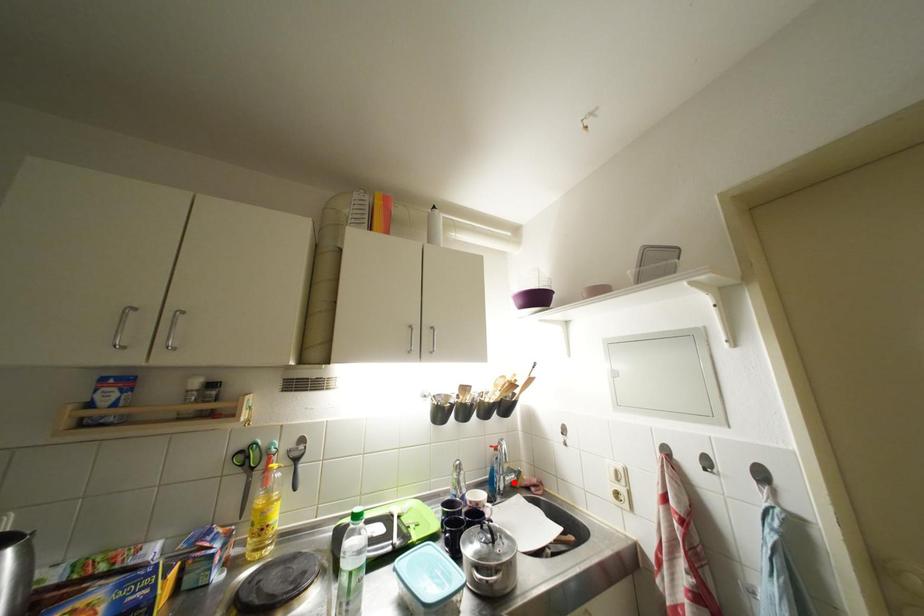
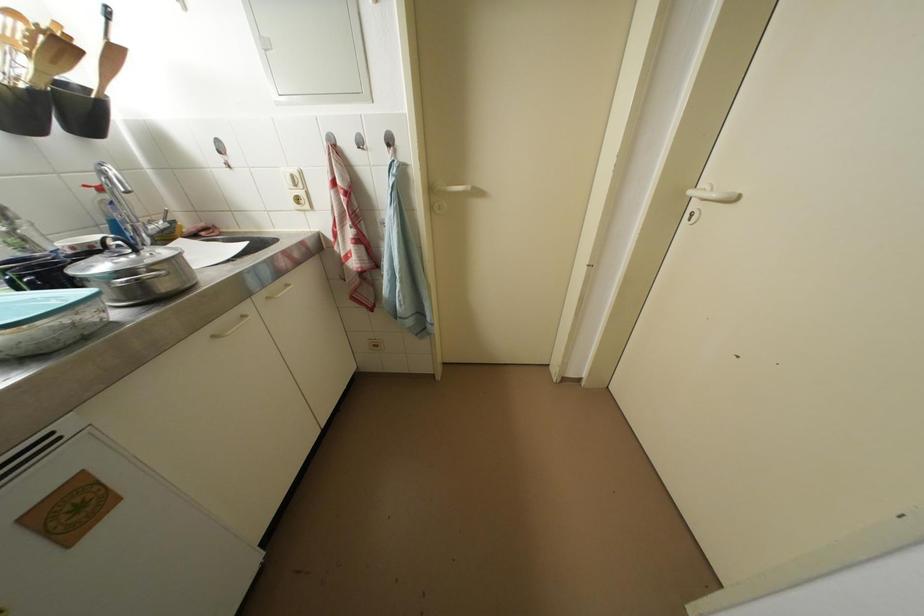
Find the pixel in the second image that matches the highlighted location in the first image.

(157, 231)